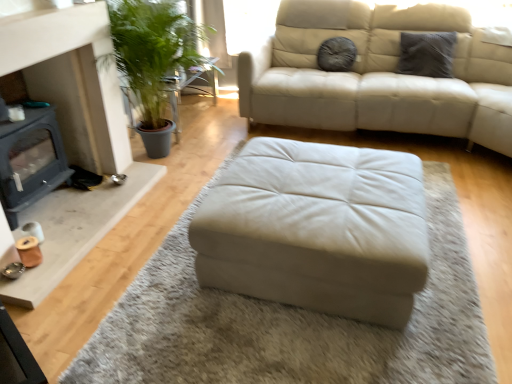
Where is `free location to the right of matte gray fireplace at lower left`? The height and width of the screenshot is (384, 512). free location to the right of matte gray fireplace at lower left is located at coordinates (111, 196).